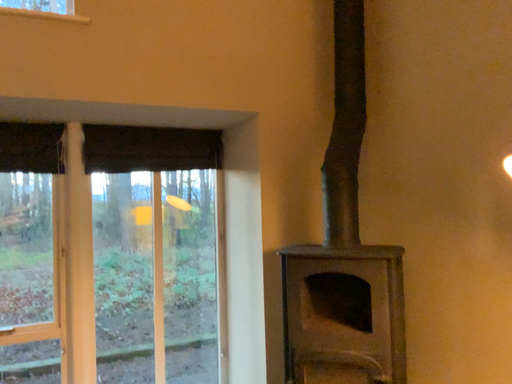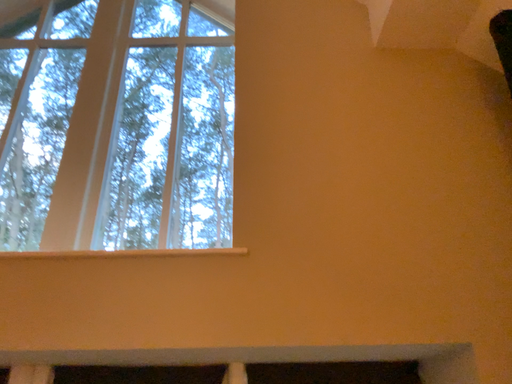
Question: Which way did the camera rotate in the video?

Choices:
 (A) rotated left
 (B) rotated right

Answer: (A)